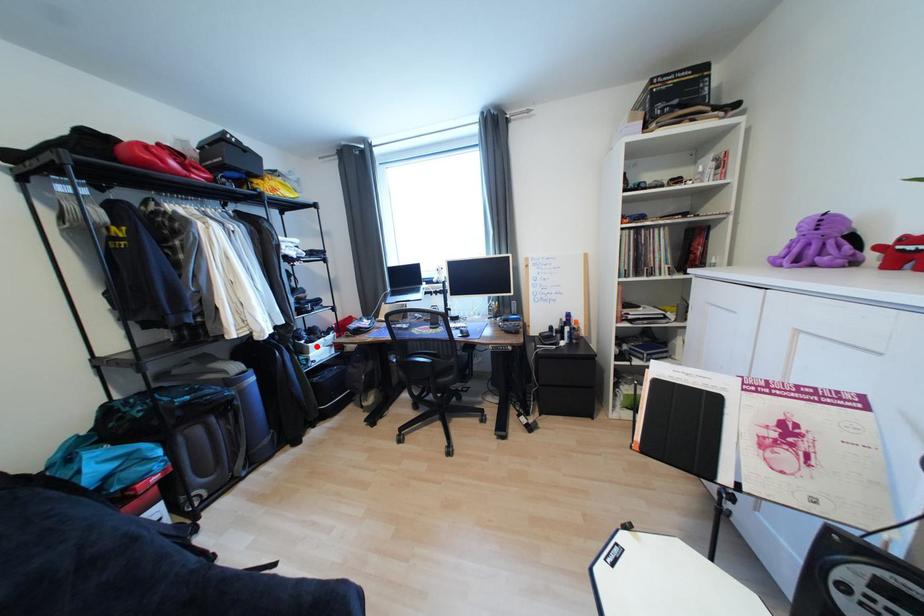
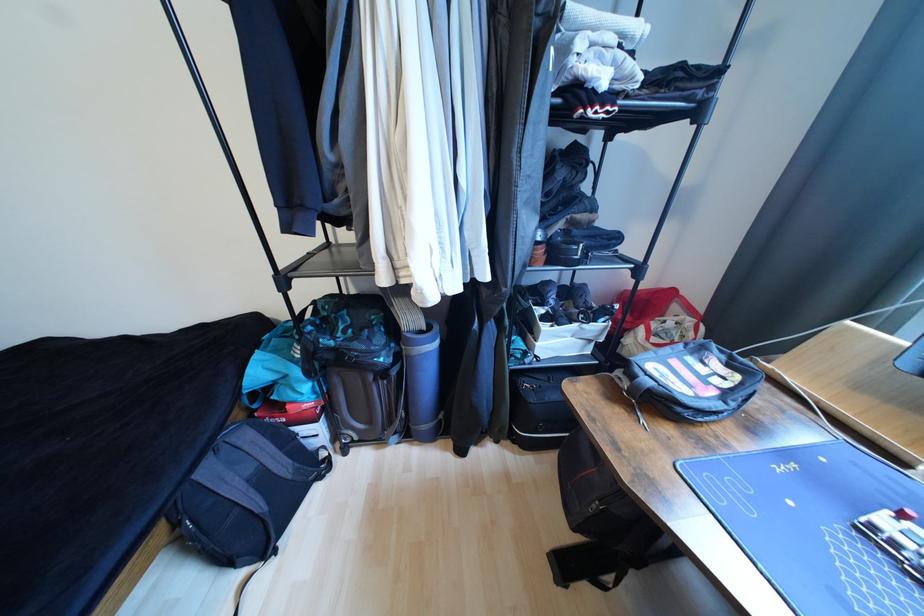
The point at the highlighted location is marked in the first image. Where is the corresponding point in the second image?

(552, 329)